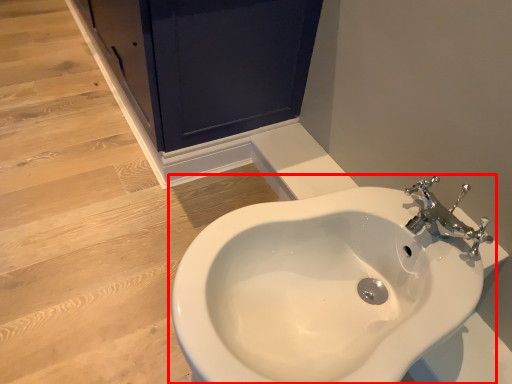
Question: From the image's perspective, where is sink (annotated by the red box) located in relation to screen door in the image?

Choices:
 (A) below
 (B) above

Answer: (A)